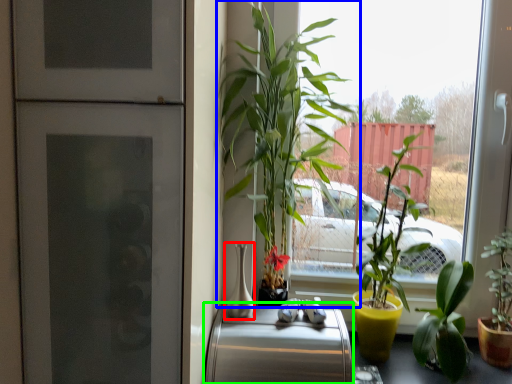
Question: Which object is positioned closest to vase (highlighted by a red box)? Select from houseplant (highlighted by a blue box) and appliance (highlighted by a green box).

Choices:
 (A) houseplant
 (B) appliance

Answer: (B)